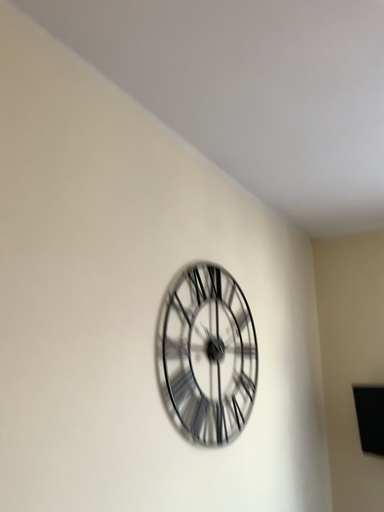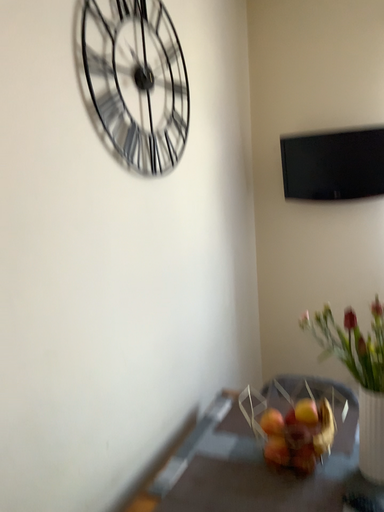
Question: How did the camera likely rotate when shooting the video?

Choices:
 (A) rotated downward
 (B) rotated upward

Answer: (A)